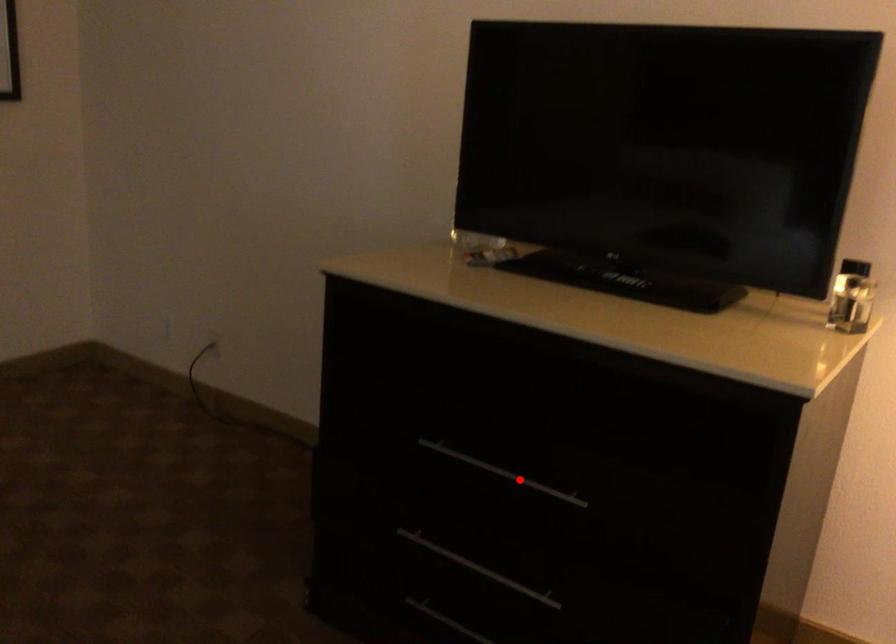
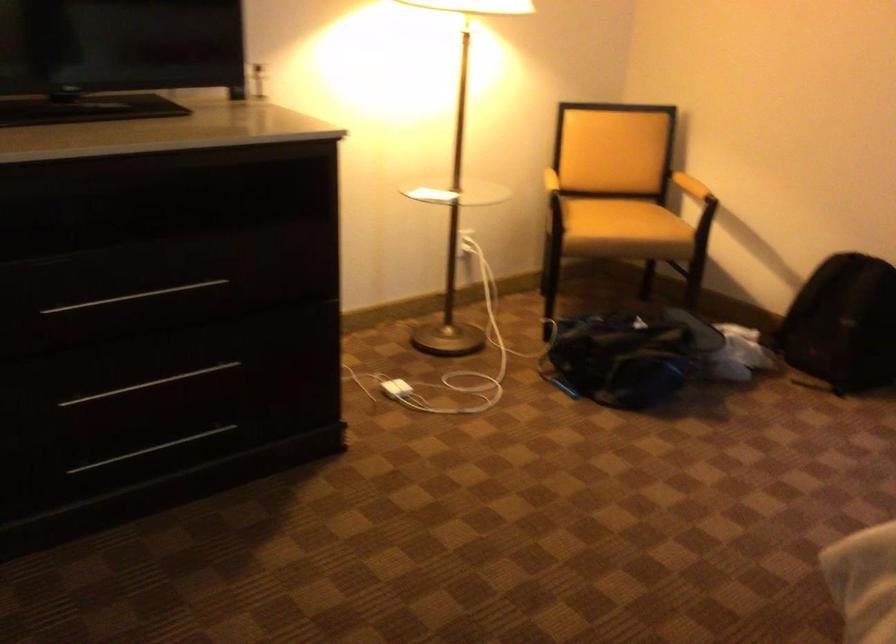
Where in the second image is the point corresponding to the highlighted location from the first image?

(134, 297)